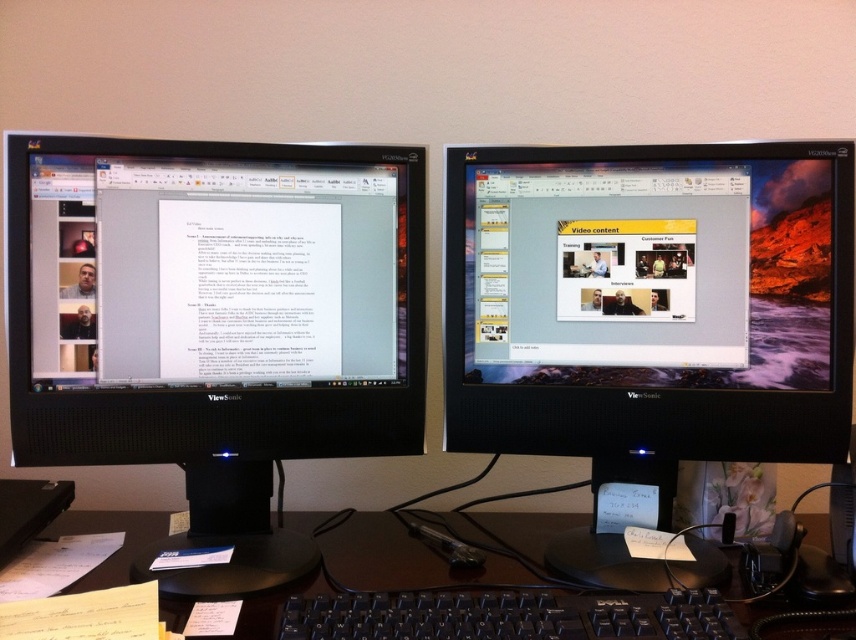
Question: Where is black plastic keyboard at lower center located in relation to black plastic keyboard at center in the image?

Choices:
 (A) below
 (B) above

Answer: (A)

Question: Which point appears farthest from the camera in this image?

Choices:
 (A) (679, 625)
 (B) (87, 157)
 (C) (565, 342)
 (D) (516, 536)

Answer: (D)

Question: Can you confirm if black plastic keyboard at lower center is thinner than black plastic keyboard at center?

Choices:
 (A) no
 (B) yes

Answer: (A)

Question: Which point is closer to the camera taking this photo?

Choices:
 (A) (325, 630)
 (B) (162, 257)
 (C) (759, 616)
 (D) (492, 257)

Answer: (A)

Question: Which object is the closest to the black plastic keyboard at center?

Choices:
 (A) black glossy monitor at left
 (B) black plastic keyboard at lower center

Answer: (B)

Question: Does black glossy monitor at left lie in front of black glossy monitor at center?

Choices:
 (A) no
 (B) yes

Answer: (B)